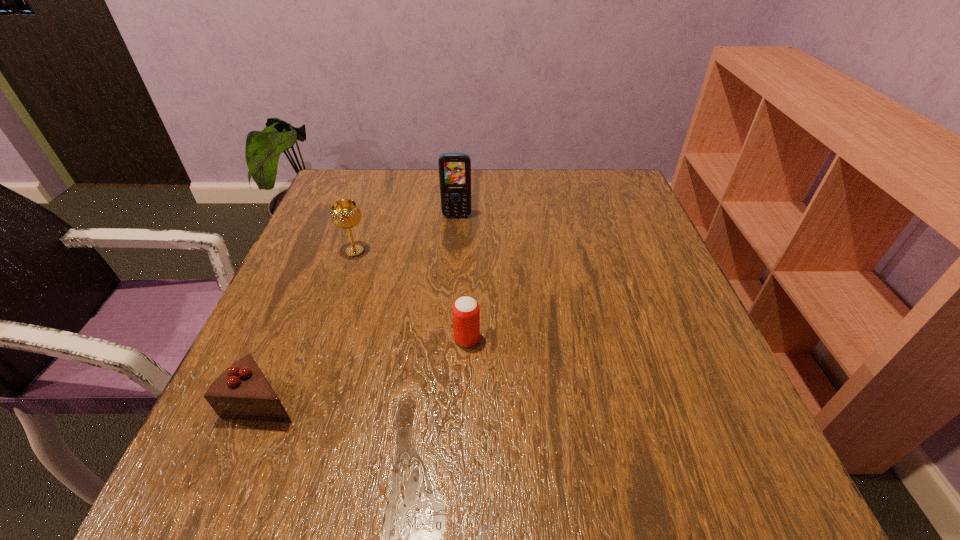
You are a GUI agent. You are given a task and a screenshot of the screen. Output one action in this format:
    pyautogui.click(x=<x>, y=<y>)
    Task: Click on the free space that satisfies the following two spatial constraints: 1. on the screen of the beer can; 2. on the right side of the farthest object
    
    Given the screenshot: What is the action you would take?
    pyautogui.click(x=448, y=339)

I want to click on vacant position in the image that satisfies the following two spatial constraints: 1. on the screen of the cellular telephone; 2. on the left side of the second nearest object, so click(448, 339).

Locate an element on the screen. Image resolution: width=960 pixels, height=540 pixels. free spot that satisfies the following two spatial constraints: 1. on the screen of the cellular telephone; 2. on the left side of the beer can is located at coordinates (448, 339).

At what (x,y) coordinates should I click in order to perform the action: click on free spot that satisfies the following two spatial constraints: 1. on the screen of the beer can; 2. on the left side of the cellular telephone. Please return your answer as a coordinate pair (x, y). Looking at the image, I should click on (448, 339).